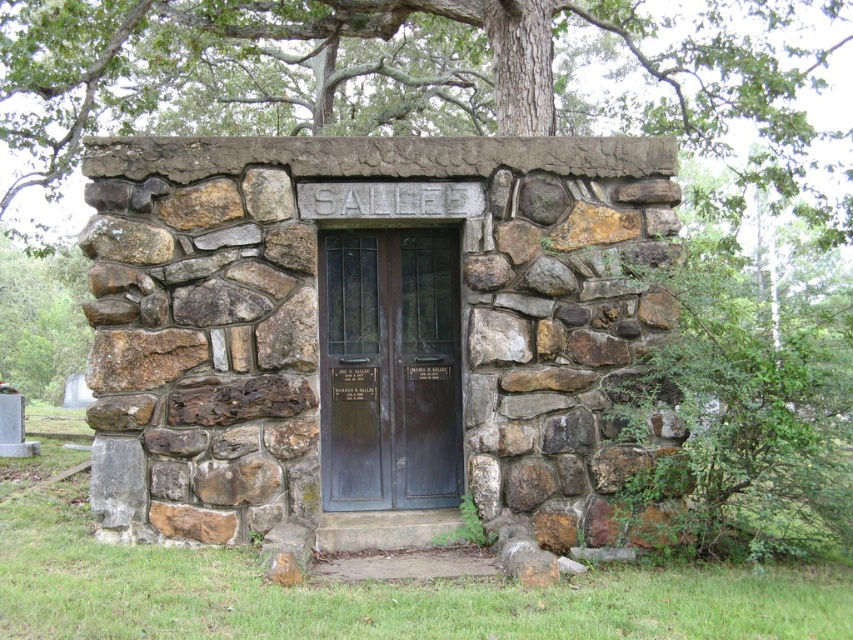
Question: Is dark brown wood door at center to the left of green leafy tree at left from the viewer's perspective?

Choices:
 (A) yes
 (B) no

Answer: (B)

Question: Can you confirm if dark brown wood door at center is positioned above green leafy tree at left?

Choices:
 (A) yes
 (B) no

Answer: (B)

Question: Which is farther from the dark brown wood door at center?

Choices:
 (A) green leafy tree at left
 (B) green leafy tree at upper center

Answer: (A)

Question: Which object appears farthest from the camera in this image?

Choices:
 (A) green leafy tree at left
 (B) dark brown wood door at center
 (C) green leafy tree at upper center
 (D) brown stone door at center

Answer: (A)

Question: Which object appears closest to the camera in this image?

Choices:
 (A) brown stone door at center
 (B) dark brown wood door at center

Answer: (A)

Question: From the image, what is the correct spatial relationship of green leafy tree at upper center in relation to green leafy tree at left?

Choices:
 (A) above
 (B) below

Answer: (A)